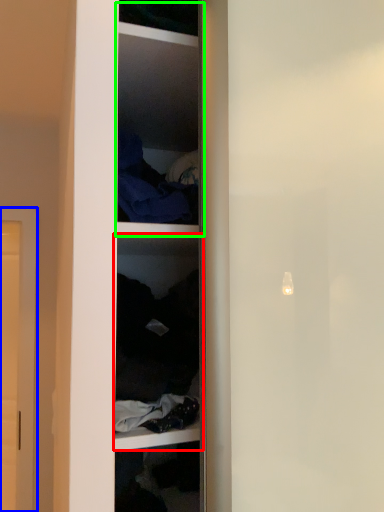
Question: Which is nearer to the shelf (highlighted by a red box)? door (highlighted by a blue box) or cabinet (highlighted by a green box).

Choices:
 (A) door
 (B) cabinet

Answer: (B)